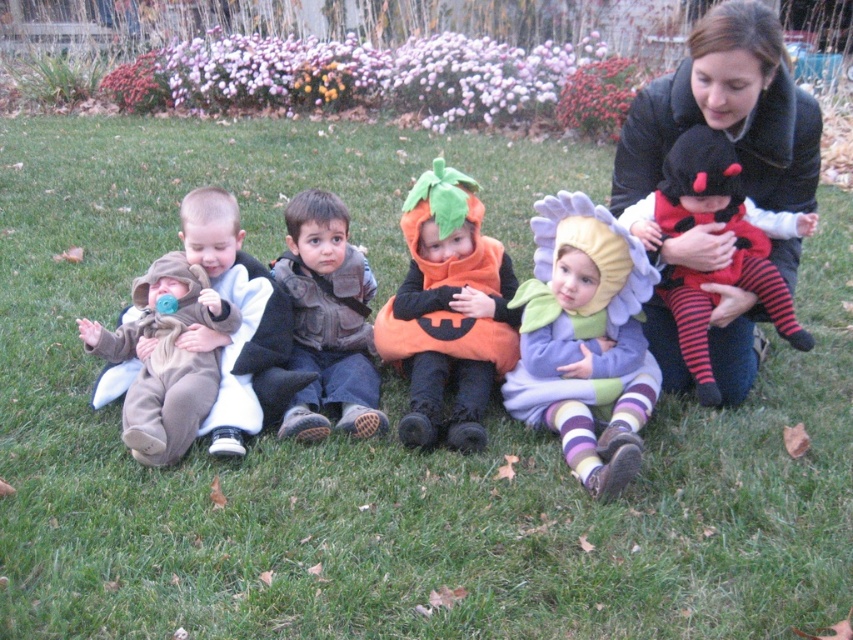
You are a parent looking at the Halloween scene. You see the purple fabric flower at center and the orange fabric pumpkin at center. Which one is directly above the other?

The purple fabric flower at center is positioned under the orange fabric pumpkin at center, so the orange fabric pumpkin at center is directly above the purple fabric flower at center.

You are a photographer setting up for a Halloween photoshoot. You need to position a purple fabric flower at center and a brown fleece onesie at left in the frame. Based on the scene description, which object should you place higher in the frame to ensure proper visibility?

The purple fabric flower at center should be placed higher in the frame because it has a larger size compared to the brown fleece onesie at left, ensuring it stands out and remains visible.